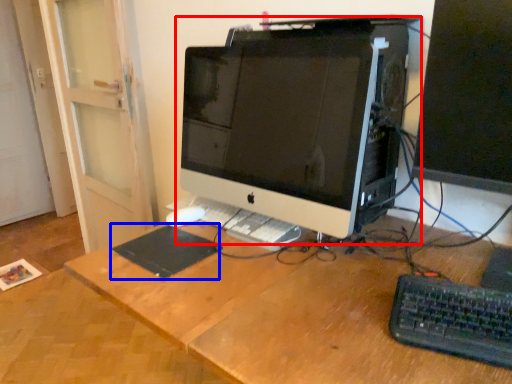
Question: Which object is closer to the camera taking this photo, computer monitor (highlighted by a red box) or mousepad (highlighted by a blue box)?

Choices:
 (A) computer monitor
 (B) mousepad

Answer: (A)